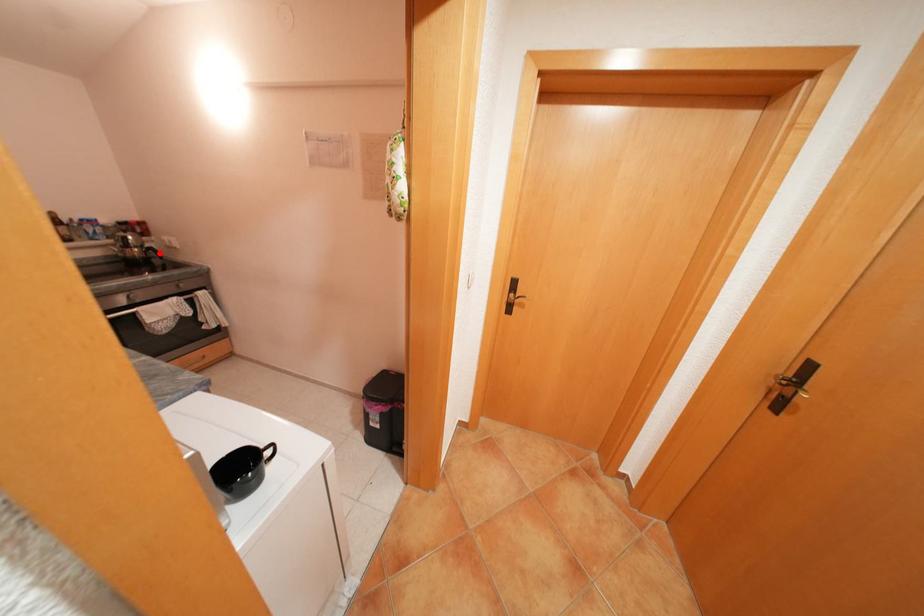
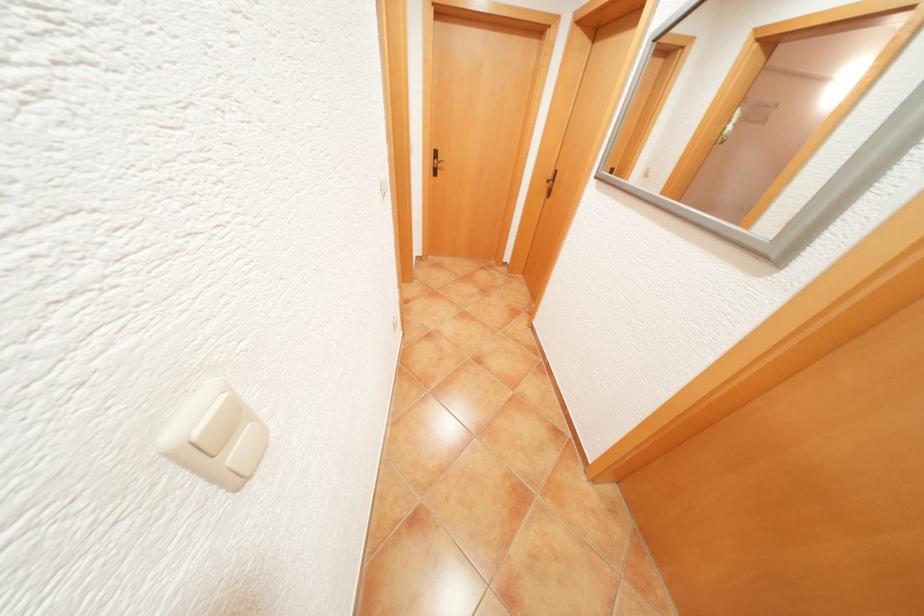
Question: I am providing you with two images of the same scene from different viewpoints. A red point is marked on the first image. At the location where the point appears in image 1, is it still visible in image 2?

Choices:
 (A) Yes
 (B) No

Answer: (B)